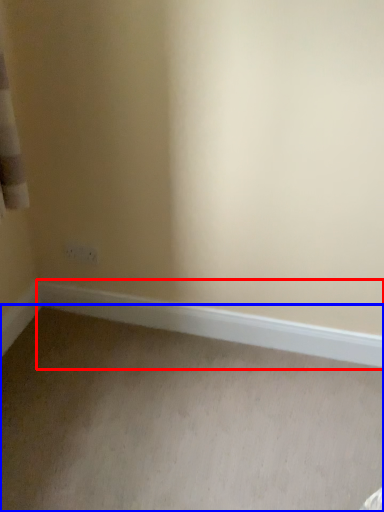
Question: Which object is further to the camera taking this photo, window sill (highlighted by a red box) or plain (highlighted by a blue box)?

Choices:
 (A) window sill
 (B) plain

Answer: (A)